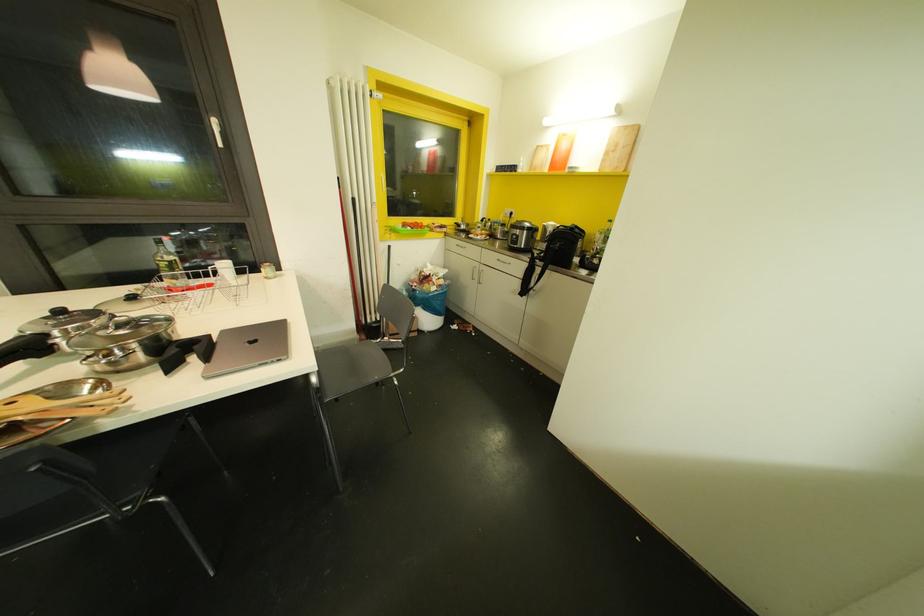
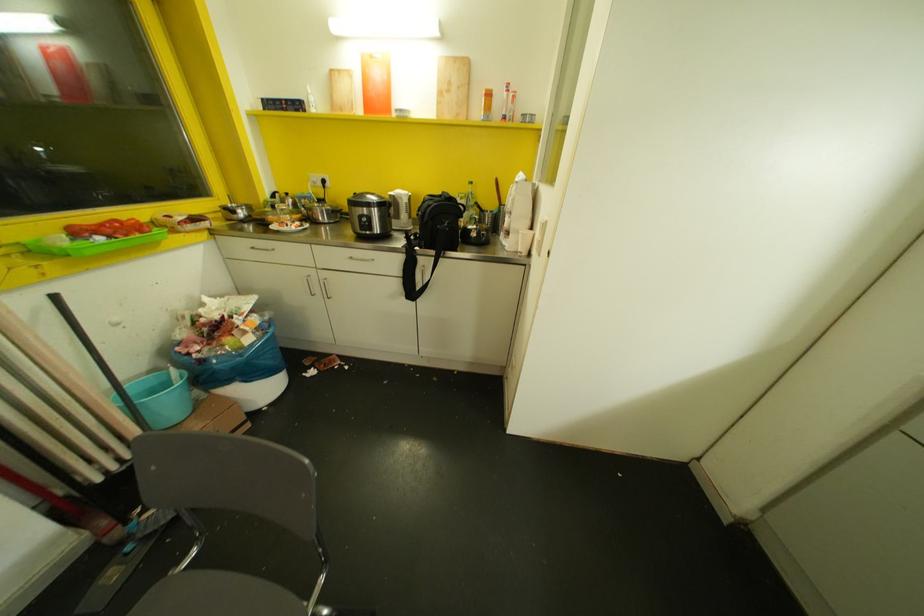
Where in the second image is the point corresponding to (x=610, y=220) from the first image?

(469, 182)